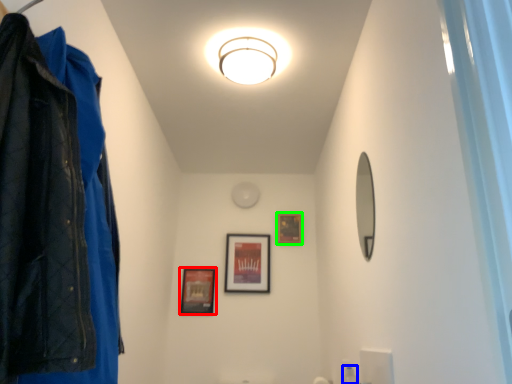
Question: Which object is the closest to the picture frame (highlighted by a red box)? Choose among these: toiletry (highlighted by a blue box) or picture frame (highlighted by a green box).

Choices:
 (A) toiletry
 (B) picture frame

Answer: (B)